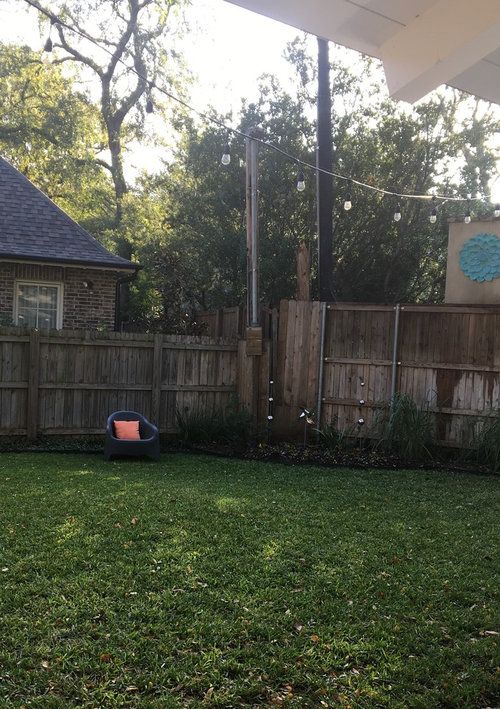
I want to click on plastic chair, so click(146, 429).